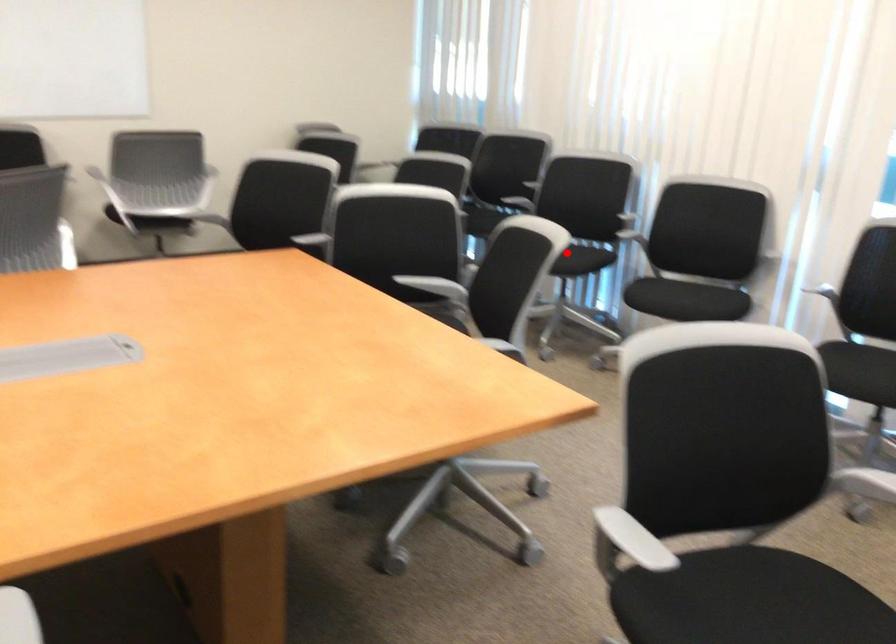
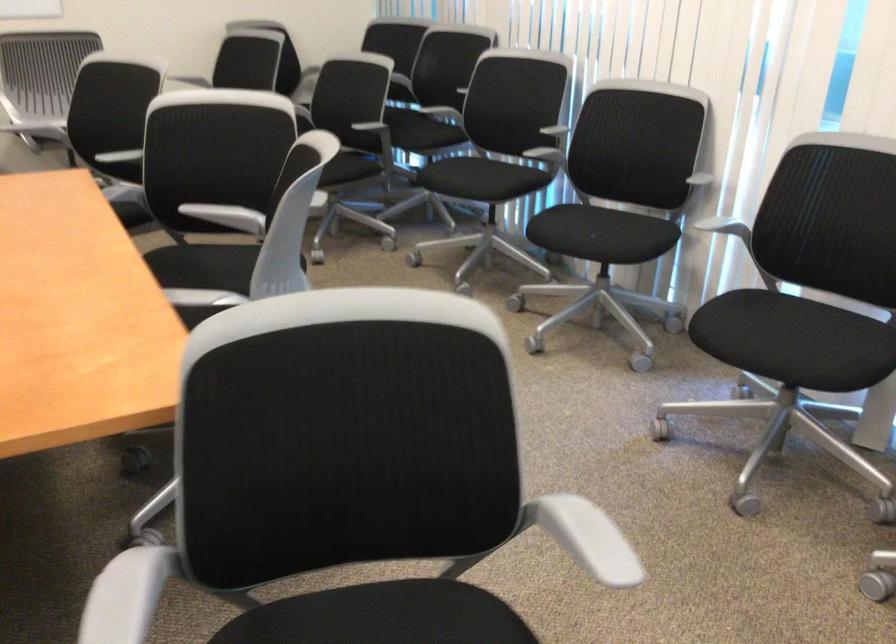
Question: A red point is marked in image1. In image2, is the corresponding 3D point closer to the camera or farther? Reply with the corresponding letter.

Choices:
 (A) The corresponding 3D point is closer.
 (B) The corresponding 3D point is farther.

Answer: (A)